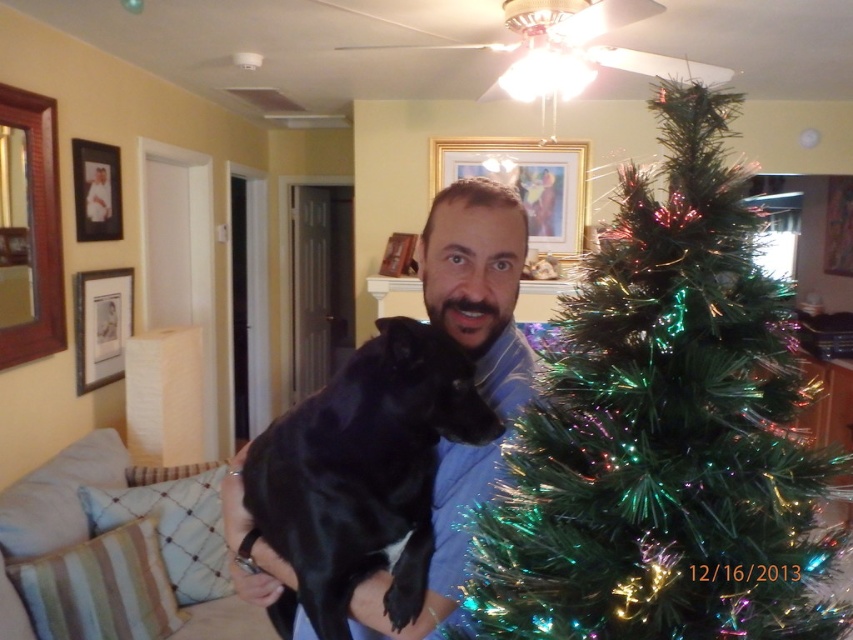
Question: Which point is farther from the camera taking this photo?

Choices:
 (A) (302, 541)
 (B) (750, 300)

Answer: (A)

Question: Does iridescent green artificial tree at right have a lesser width compared to black shiny dog at center?

Choices:
 (A) yes
 (B) no

Answer: (B)

Question: Does iridescent green artificial tree at right have a greater width compared to black shiny dog at center?

Choices:
 (A) yes
 (B) no

Answer: (A)

Question: Which point is farther from the camera taking this photo?

Choices:
 (A) (367, 566)
 (B) (558, 538)

Answer: (A)

Question: Which point is closer to the camera?

Choices:
 (A) iridescent green artificial tree at right
 (B) black shiny dog at center

Answer: (A)

Question: Does iridescent green artificial tree at right have a lesser width compared to black shiny dog at center?

Choices:
 (A) yes
 (B) no

Answer: (B)